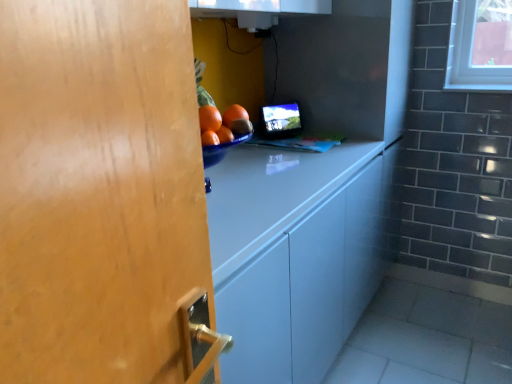
What do you see at coordinates (310, 196) in the screenshot? The width and height of the screenshot is (512, 384). I see `white glossy cabinet at center` at bounding box center [310, 196].

What is the approximate height of white glossy cabinet at center?

5.02 feet.

Find the location of a particular element. This screenshot has width=512, height=384. white glossy cabinet at center is located at coordinates (310, 196).

Describe the element at coordinates (280, 120) in the screenshot. I see `matte black monitor at center` at that location.

This screenshot has height=384, width=512. I want to click on matte black monitor at center, so click(280, 120).

Find the location of a particular element. Image resolution: width=512 pixels, height=384 pixels. white glossy cabinet at center is located at coordinates (310, 196).

Between matte black monitor at center and white glossy cabinet at center, which one appears on the right side from the viewer's perspective?

Positioned to the right is white glossy cabinet at center.

Is matte black monitor at center in front of or behind white glossy cabinet at center in the image?

matte black monitor at center is behind white glossy cabinet at center.

Is point (265, 118) positioned before point (308, 359)?

That is False.

From the image's perspective, who appears lower, matte black monitor at center or white glossy cabinet at center?

white glossy cabinet at center, from the image's perspective.

From a real-world perspective, is matte black monitor at center above or below white glossy cabinet at center?

From a real-world perspective, matte black monitor at center is physically above white glossy cabinet at center.

Does matte black monitor at center have a lesser width compared to white glossy cabinet at center?

Indeed, matte black monitor at center has a lesser width compared to white glossy cabinet at center.

In terms of height, does matte black monitor at center look taller or shorter compared to white glossy cabinet at center?

Considering their sizes, matte black monitor at center has less height than white glossy cabinet at center.

Which of these two, matte black monitor at center or white glossy cabinet at center, is smaller?

matte black monitor at center.

Is matte black monitor at center inside the boundaries of white glossy cabinet at center, or outside?

matte black monitor at center is outside white glossy cabinet at center.

Are matte black monitor at center and white glossy cabinet at center making contact?

No, matte black monitor at center is not with white glossy cabinet at center.

Consider the image. Is matte black monitor at center positioned with its back to white glossy cabinet at center?

Yes, white glossy cabinet at center is at the back of matte black monitor at center.

How different are the orientations of matte black monitor at center and white glossy cabinet at center in degrees?

The angle between the facing direction of matte black monitor at center and the facing direction of white glossy cabinet at center is 34.5 degrees.

Locate an element on the screen. This screenshot has width=512, height=384. computer monitor on the left of white glossy cabinet at center is located at coordinates (280, 120).

Between white glossy cabinet at center and matte black monitor at center, which one appears on the right side from the viewer's perspective?

white glossy cabinet at center is more to the right.

Is white glossy cabinet at center in front of or behind matte black monitor at center in the image?

Clearly, white glossy cabinet at center is in front of matte black monitor at center.

Is point (383, 120) in front of point (274, 105)?

Yes, point (383, 120) is in front of point (274, 105).

From the image's perspective, is white glossy cabinet at center located above matte black monitor at center?

No, from the image's perspective, white glossy cabinet at center is not on top of matte black monitor at center.

From a real-world perspective, who is located lower, white glossy cabinet at center or matte black monitor at center?

From a 3D spatial view, white glossy cabinet at center is below.

Can you confirm if white glossy cabinet at center is thinner than matte black monitor at center?

No.

Can you confirm if white glossy cabinet at center is taller than matte black monitor at center?

Yes.

Is white glossy cabinet at center bigger or smaller than matte black monitor at center?

Considering their sizes, white glossy cabinet at center takes up more space than matte black monitor at center.

Is white glossy cabinet at center outside of matte black monitor at center?

Yes, white glossy cabinet at center is outside of matte black monitor at center.

Is the surface of white glossy cabinet at center in direct contact with matte black monitor at center?

There is a gap between white glossy cabinet at center and matte black monitor at center.

Could you tell me if white glossy cabinet at center is turned towards matte black monitor at center?

No, white glossy cabinet at center is not facing towards matte black monitor at center.

How different are the orientations of white glossy cabinet at center and matte black monitor at center in degrees?

There is a 34.5-degree angle between the facing directions of white glossy cabinet at center and matte black monitor at center.

The width and height of the screenshot is (512, 384). In the image, there is a white glossy cabinet at center. In order to click on computer monitor above it (from the image's perspective) in this screenshot , I will do `click(280, 120)`.

Where is `computer monitor above the white glossy cabinet at center (from a real-world perspective)`? The image size is (512, 384). computer monitor above the white glossy cabinet at center (from a real-world perspective) is located at coordinates (280, 120).

I want to click on cabinetry lying in front of the matte black monitor at center, so coord(310,196).